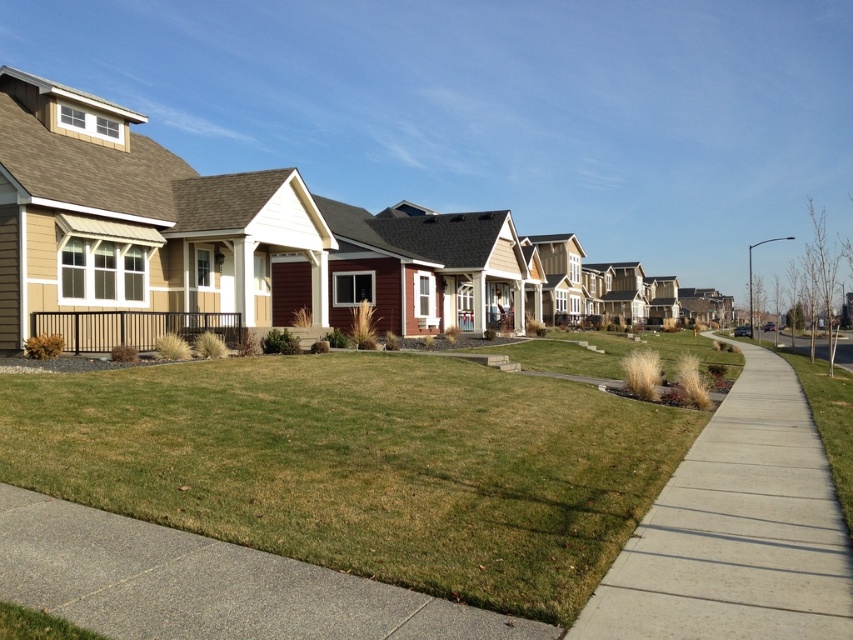
How far apart are green grass at center and concrete sidewalk at center?

green grass at center and concrete sidewalk at center are 4.02 meters apart.

Is point (675, 346) behind point (714, 461)?

Yes, it is.

Locate an element on the screen. This screenshot has width=853, height=640. green grass at center is located at coordinates (361, 465).

Which is below, concrete sidewalk at center or gray concrete sidewalk at lower center?

concrete sidewalk at center

Is concrete sidewalk at center taller than gray concrete sidewalk at lower center?

No.

At what (x,y) coordinates should I click in order to perform the action: click on concrete sidewalk at center. Please return your answer as a coordinate pair (x, y). Looking at the image, I should click on (735, 531).

I want to click on concrete sidewalk at center, so click(735, 531).

Does green grass at center have a smaller size compared to gray concrete sidewalk at lower center?

No, green grass at center is not smaller than gray concrete sidewalk at lower center.

Does point (256, 500) come closer to viewer compared to point (189, 579)?

That is False.

Is point (171, 496) positioned in front of point (317, 608)?

No, it is not.

Locate an element on the screen. This screenshot has height=640, width=853. green grass at center is located at coordinates (361, 465).